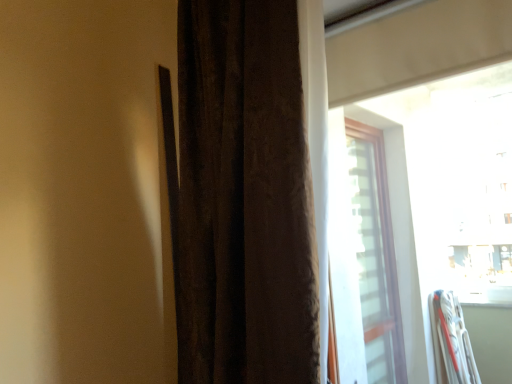
Question: From a real-world perspective, is brown textured curtain at center positioned above or below transparent glass window at upper right?

Choices:
 (A) above
 (B) below

Answer: (A)

Question: From their relative heights in the image, would you say brown textured curtain at center is taller or shorter than transparent glass window at upper right?

Choices:
 (A) short
 (B) tall

Answer: (B)

Question: Does point (294, 77) appear closer or farther from the camera than point (331, 59)?

Choices:
 (A) closer
 (B) farther

Answer: (A)

Question: Does point (432, 107) appear closer or farther from the camera than point (254, 228)?

Choices:
 (A) closer
 (B) farther

Answer: (B)

Question: Is transparent glass window at upper right wider or thinner than brown textured curtain at center?

Choices:
 (A) thin
 (B) wide

Answer: (A)

Question: Is transparent glass window at upper right to the left or to the right of brown textured curtain at center in the image?

Choices:
 (A) right
 (B) left

Answer: (A)

Question: From their relative heights in the image, would you say transparent glass window at upper right is taller or shorter than brown textured curtain at center?

Choices:
 (A) short
 (B) tall

Answer: (A)